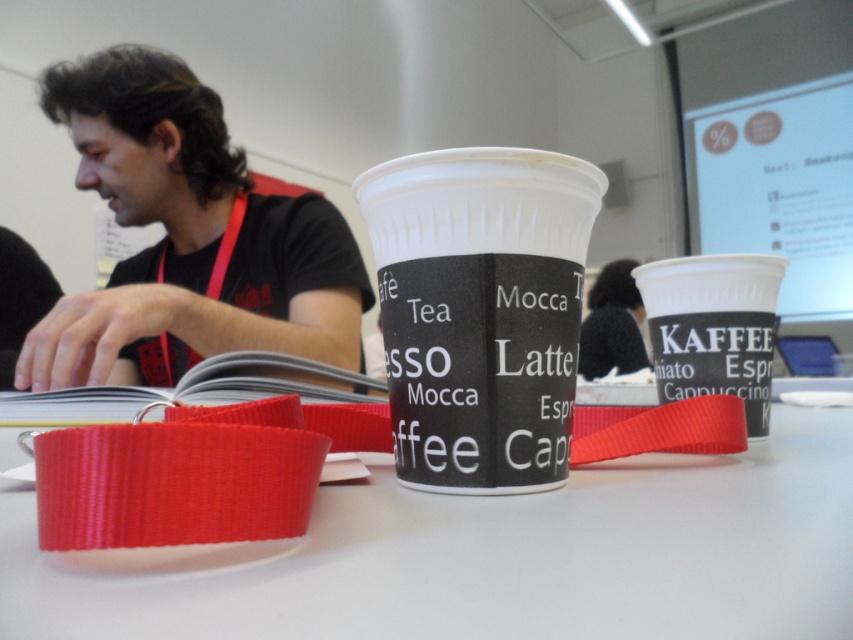
Which is more to the right, matte black shirt at left or matte black paper cup at right?

matte black paper cup at right is more to the right.

Can you confirm if matte black shirt at left is positioned above matte black paper cup at right?

Correct, matte black shirt at left is located above matte black paper cup at right.

Where is `matte black shirt at left`? matte black shirt at left is located at coordinates (187, 237).

You are a GUI agent. You are given a task and a screenshot of the screen. Output one action in this format:
    pyautogui.click(x=<x>, y=<y>)
    Task: Click on the white plastic table at center
    This screenshot has height=640, width=853.
    Given the screenshot: What is the action you would take?
    pyautogui.click(x=503, y=557)

Does white plastic table at center have a greater height compared to white matte paper cup at center?

No.

Does point (717, 472) come closer to viewer compared to point (495, 371)?

No, it is behind (495, 371).

At what (x,y) coordinates should I click in order to perform the action: click on white plastic table at center. Please return your answer as a coordinate pair (x, y). Looking at the image, I should click on (503, 557).

What do you see at coordinates (480, 310) in the screenshot?
I see `white matte paper cup at center` at bounding box center [480, 310].

In the scene shown: Who is more distant from viewer, [386,184] or [729,298]?

The point [729,298] is behind.

Identify the location of white matte paper cup at center. (480, 310).